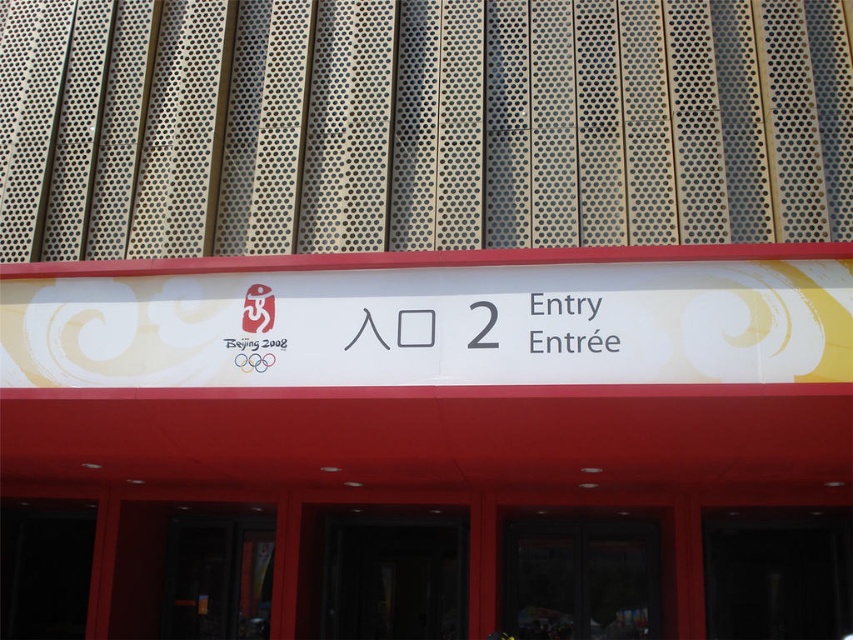
From the picture: Who is shorter, black glass door at center or white paper at center?

white paper at center is shorter.

Find the location of a particular element. black glass door at center is located at coordinates (776, 573).

This screenshot has height=640, width=853. Identify the location of black glass door at center. (776, 573).

Is point (107, 285) positioned behind point (387, 636)?

No, it is not.

Is white plastic sign at center to the left of dark glass door at center from the viewer's perspective?

Indeed, white plastic sign at center is positioned on the left side of dark glass door at center.

Does point (814, 339) lie behind point (467, 548)?

No.

Identify the location of white plastic sign at center. The height and width of the screenshot is (640, 853). (437, 326).

Does point (424, 513) come farther from viewer compared to point (846, 529)?

Yes, it is.

Can you confirm if dark glass door at center is thinner than black glass door at center?

In fact, dark glass door at center might be wider than black glass door at center.

You are a GUI agent. You are given a task and a screenshot of the screen. Output one action in this format:
    pyautogui.click(x=<x>, y=<y>)
    Task: Click on the dark glass door at center
    This screenshot has height=640, width=853.
    Given the screenshot: What is the action you would take?
    pyautogui.click(x=386, y=573)

The width and height of the screenshot is (853, 640). In order to click on dark glass door at center in this screenshot , I will do `click(386, 573)`.